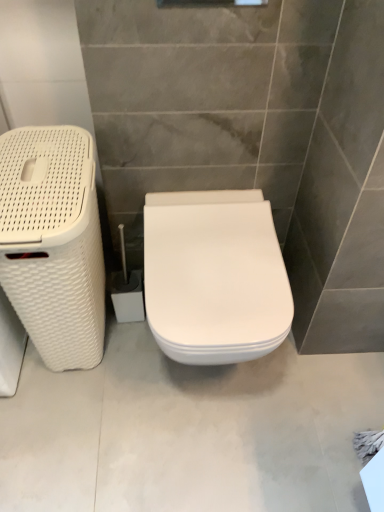
Question: Does white glossy toilet at center appear on the right side of white woven laundry basket at left?

Choices:
 (A) yes
 (B) no

Answer: (A)

Question: Considering the relative sizes of white glossy toilet at center and white woven laundry basket at left in the image provided, is white glossy toilet at center thinner than white woven laundry basket at left?

Choices:
 (A) yes
 (B) no

Answer: (B)

Question: Is white glossy toilet at center completely or partially outside of white woven laundry basket at left?

Choices:
 (A) no
 (B) yes

Answer: (B)

Question: From a real-world perspective, is white glossy toilet at center on white woven laundry basket at left?

Choices:
 (A) no
 (B) yes

Answer: (A)

Question: Does white glossy toilet at center touch white woven laundry basket at left?

Choices:
 (A) yes
 (B) no

Answer: (B)

Question: From the image's perspective, is white glossy toilet at center under white woven laundry basket at left?

Choices:
 (A) no
 (B) yes

Answer: (B)

Question: Are white glossy toilet at center and white glossy toilet at center beside each other?

Choices:
 (A) no
 (B) yes

Answer: (A)

Question: Is white glossy toilet at center outside of white glossy toilet at center?

Choices:
 (A) yes
 (B) no

Answer: (A)

Question: From a real-world perspective, does white glossy toilet at center stand above white glossy toilet at center?

Choices:
 (A) no
 (B) yes

Answer: (B)

Question: From a real-world perspective, is white glossy toilet at center below white glossy toilet at center?

Choices:
 (A) no
 (B) yes

Answer: (A)

Question: From the image's perspective, is white glossy toilet at center beneath white glossy toilet at center?

Choices:
 (A) no
 (B) yes

Answer: (A)

Question: Can you confirm if white glossy toilet at center is positioned to the left of white glossy toilet at center?

Choices:
 (A) yes
 (B) no

Answer: (B)

Question: Can you confirm if white glossy toilet at center is positioned to the right of white woven laundry basket at left?

Choices:
 (A) no
 (B) yes

Answer: (B)